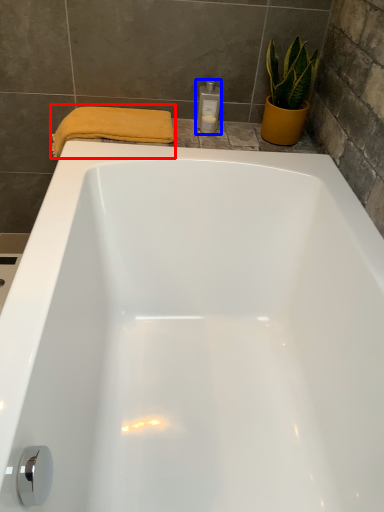
Question: Which point is closer to the camera, bath towel (highlighted by a red box) or toiletry (highlighted by a blue box)?

Choices:
 (A) bath towel
 (B) toiletry

Answer: (A)